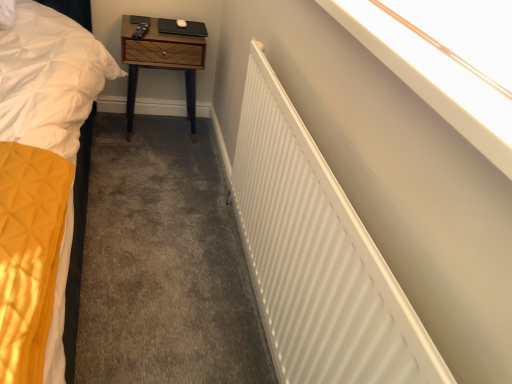
Question: Is white smooth wall at upper right bigger than woodenmaterial/texturenightstand at upper center?

Choices:
 (A) yes
 (B) no

Answer: (B)

Question: Does white smooth wall at upper right come behind woodenmaterial/texturenightstand at upper center?

Choices:
 (A) yes
 (B) no

Answer: (B)

Question: Could you tell me if white smooth wall at upper right is turned towards woodenmaterial/texturenightstand at upper center?

Choices:
 (A) yes
 (B) no

Answer: (B)

Question: Is the position of white smooth wall at upper right less distant than that of woodenmaterial/texturenightstand at upper center?

Choices:
 (A) no
 (B) yes

Answer: (B)

Question: Can you confirm if white smooth wall at upper right is positioned to the right of woodenmaterial/texturenightstand at upper center?

Choices:
 (A) yes
 (B) no

Answer: (A)

Question: Considering the positions of point tap(352, 372) and point tap(129, 19), is point tap(352, 372) closer or farther from the camera than point tap(129, 19)?

Choices:
 (A) farther
 (B) closer

Answer: (B)

Question: In terms of size, does white matte radiator at upper right appear bigger or smaller than woodenmaterial/texturenightstand at upper center?

Choices:
 (A) big
 (B) small

Answer: (A)

Question: From a real-world perspective, is white matte radiator at upper right physically located above or below woodenmaterial/texturenightstand at upper center?

Choices:
 (A) above
 (B) below

Answer: (A)

Question: Considering their positions, is white matte radiator at upper right located in front of or behind woodenmaterial/texturenightstand at upper center?

Choices:
 (A) behind
 (B) front

Answer: (B)

Question: In terms of width, does white matte radiator at upper right look wider or thinner when compared to white smooth wall at upper right?

Choices:
 (A) wide
 (B) thin

Answer: (B)

Question: In terms of height, does white matte radiator at upper right look taller or shorter compared to white smooth wall at upper right?

Choices:
 (A) tall
 (B) short

Answer: (A)

Question: Considering their positions, is white matte radiator at upper right located in front of or behind white smooth wall at upper right?

Choices:
 (A) behind
 (B) front

Answer: (A)

Question: From the image's perspective, is white matte radiator at upper right positioned above or below white smooth wall at upper right?

Choices:
 (A) above
 (B) below

Answer: (B)

Question: From a real-world perspective, is woodenmaterial/texturenightstand at upper center positioned above or below white matte radiator at upper right?

Choices:
 (A) below
 (B) above

Answer: (A)

Question: Looking at their shapes, would you say woodenmaterial/texturenightstand at upper center is wider or thinner than white matte radiator at upper right?

Choices:
 (A) wide
 (B) thin

Answer: (A)